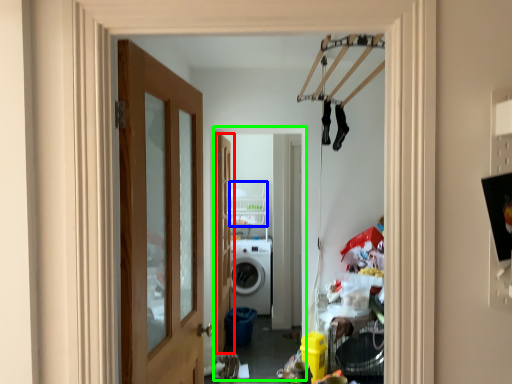
Question: Based on their relative distances, which object is nearer to door (highlighted by a red box)? Choose from shelf (highlighted by a blue box) and corridor (highlighted by a green box).

Choices:
 (A) shelf
 (B) corridor

Answer: (B)